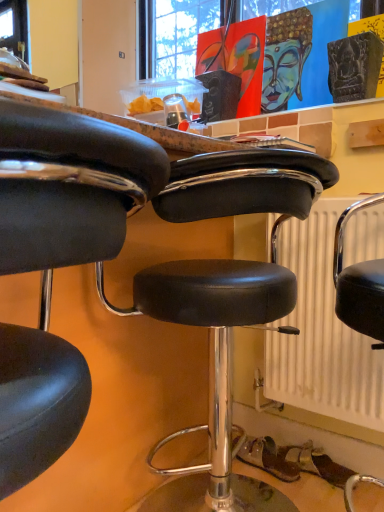
The height and width of the screenshot is (512, 384). Identify the location of black leather stool at center, the 1th chair from the back. (212, 366).

What is the approximate height of white textured radiator at center?

white textured radiator at center is 36.32 inches in height.

I want to click on black leather stool at center, arranged as the second chair when viewed from the front, so click(x=212, y=366).

Is black leather stool at center, arranged as the second chair when viewed from the front, positioned with its back to white textured radiator at center?

Yes.

Between black leather stool at center, arranged as the second chair when viewed from the front, and white textured radiator at center, which one has less height?

With less height is black leather stool at center, arranged as the second chair when viewed from the front.

Is point (186, 168) behind point (328, 238)?

No, (186, 168) is in front of (328, 238).

From the image's perspective, which one is positioned higher, black leather stool at center, arranged as the second chair when viewed from the front, or white textured radiator at center?

white textured radiator at center.

Is black leather stool at center, which ranks as the first chair in front-to-back order, aimed at black leather stool at center, arranged as the second chair when viewed from the front?

No, black leather stool at center, which ranks as the first chair in front-to-back order, is not turned towards black leather stool at center, arranged as the second chair when viewed from the front.

Which is closer, (44,431) or (167,319)?

The point (44,431) is more forward.

Is black leather stool at center, which ranks as the first chair in front-to-back order, in contact with black leather stool at center, the 1th chair from the back?

No, black leather stool at center, which ranks as the first chair in front-to-back order, is not beside black leather stool at center, the 1th chair from the back.

Is black leather stool at center, which ranks as the first chair in front-to-back order, thinner than white textured radiator at center?

No.

Based on the photo, between black leather stool at center, placed as the 2th chair when sorted from back to front, and white textured radiator at center, which one appears on the right side from the viewer's perspective?

white textured radiator at center is more to the right.

From a real-world perspective, relative to white textured radiator at center, is black leather stool at center, placed as the 2th chair when sorted from back to front, vertically above or below?

In terms of real-world spatial position, black leather stool at center, placed as the 2th chair when sorted from back to front, is above white textured radiator at center.

Considering the sizes of black leather stool at center, placed as the 2th chair when sorted from back to front, and white textured radiator at center in the image, is black leather stool at center, placed as the 2th chair when sorted from back to front, taller or shorter than white textured radiator at center?

In the image, black leather stool at center, placed as the 2th chair when sorted from back to front, appears to be shorter than white textured radiator at center.

Does point (379, 231) come closer to viewer compared to point (167, 262)?

No, (379, 231) is further to viewer.

Considering the positions of objects white textured radiator at center and black leather stool at center, arranged as the second chair when viewed from the front, in the image provided, who is more to the left, white textured radiator at center or black leather stool at center, arranged as the second chair when viewed from the front,?

Positioned to the left is black leather stool at center, arranged as the second chair when viewed from the front.

In the scene shown: Is white textured radiator at center smaller than black leather stool at center, the 1th chair from the back?

Yes, white textured radiator at center is smaller than black leather stool at center, the 1th chair from the back.

How distant is white textured radiator at center from black leather stool at center, arranged as the second chair when viewed from the front?

They are 21.58 centimeters apart.

Who is bigger, white textured radiator at center or black leather stool at center, which ranks as the first chair in front-to-back order?

With larger size is black leather stool at center, which ranks as the first chair in front-to-back order.

From the image's perspective, is white textured radiator at center on black leather stool at center, placed as the 2th chair when sorted from back to front?

Actually, white textured radiator at center appears below black leather stool at center, placed as the 2th chair when sorted from back to front, in the image.

Consider the image. Is black leather stool at center, which ranks as the first chair in front-to-back order, inside white textured radiator at center?

No, black leather stool at center, which ranks as the first chair in front-to-back order, is not a part of white textured radiator at center.

Considering the positions of objects white textured radiator at center and black leather stool at center, placed as the 2th chair when sorted from back to front, in the image provided, who is more to the right, white textured radiator at center or black leather stool at center, placed as the 2th chair when sorted from back to front,?

white textured radiator at center.

Which is closer to the camera, (235, 318) or (101, 136)?

Point (235, 318) is farther from the camera than point (101, 136).

Is black leather stool at center, arranged as the second chair when viewed from the front, beside black leather stool at center, placed as the 2th chair when sorted from back to front?

black leather stool at center, arranged as the second chair when viewed from the front, and black leather stool at center, placed as the 2th chair when sorted from back to front, are not in contact.

Considering the relative positions of black leather stool at center, the 1th chair from the back, and black leather stool at center, placed as the 2th chair when sorted from back to front, in the image provided, is black leather stool at center, the 1th chair from the back, to the left of black leather stool at center, placed as the 2th chair when sorted from back to front, from the viewer's perspective?

In fact, black leather stool at center, the 1th chair from the back, is to the right of black leather stool at center, placed as the 2th chair when sorted from back to front.

Find the location of `chair below the white textured radiator at center (from a real-world perspective)`. chair below the white textured radiator at center (from a real-world perspective) is located at coordinates (212, 366).

Locate an element on the screen. chair on the left of the black leather stool at center, the 1th chair from the back is located at coordinates (58, 262).

Estimate the real-world distances between objects in this image. Which object is closer to black leather stool at center, arranged as the second chair when viewed from the front, black leather stool at center, which ranks as the first chair in front-to-back order, or white textured radiator at center?

white textured radiator at center.

When comparing their distances from white textured radiator at center, does black leather stool at center, arranged as the second chair when viewed from the front, or black leather stool at center, which ranks as the first chair in front-to-back order, seem closer?

black leather stool at center, arranged as the second chair when viewed from the front, lies closer to white textured radiator at center than the other object.

Based on their spatial positions, is white textured radiator at center or black leather stool at center, the 1th chair from the back, closer to black leather stool at center, which ranks as the first chair in front-to-back order?

Based on the image, black leather stool at center, the 1th chair from the back, appears to be nearer to black leather stool at center, which ranks as the first chair in front-to-back order.

When comparing their distances from white textured radiator at center, does black leather stool at center, which ranks as the first chair in front-to-back order, or black leather stool at center, the 1th chair from the back, seem closer?

Based on the image, black leather stool at center, the 1th chair from the back, appears to be nearer to white textured radiator at center.

Considering their positions, is white textured radiator at center positioned further to black leather stool at center, the 1th chair from the back, than black leather stool at center, placed as the 2th chair when sorted from back to front?

The object further to black leather stool at center, the 1th chair from the back, is black leather stool at center, placed as the 2th chair when sorted from back to front.

In the scene shown: Based on their spatial positions, is black leather stool at center, arranged as the second chair when viewed from the front, or white textured radiator at center closer to black leather stool at center, which ranks as the first chair in front-to-back order?

black leather stool at center, arranged as the second chair when viewed from the front, lies closer to black leather stool at center, which ranks as the first chair in front-to-back order, than the other object.

Where is `chair situated between black leather stool at center, placed as the 2th chair when sorted from back to front, and white textured radiator at center from left to right`? chair situated between black leather stool at center, placed as the 2th chair when sorted from back to front, and white textured radiator at center from left to right is located at coordinates (212, 366).